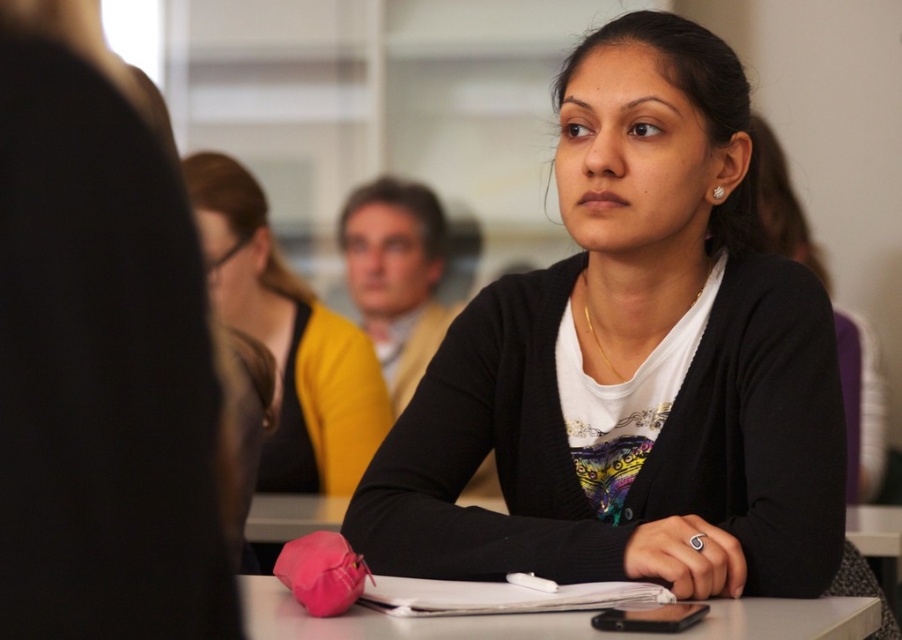
Who is more distant from viewer, (526,328) or (788,621)?

The point (526,328) is more distant.

How much distance is there between black matte cardigan at center and white paper at center?

The distance of black matte cardigan at center from white paper at center is 31.44 centimeters.

You are a GUI agent. You are given a task and a screenshot of the screen. Output one action in this format:
    pyautogui.click(x=<x>, y=<y>)
    Task: Click on the black matte cardigan at center
    The image size is (902, 640).
    Given the screenshot: What is the action you would take?
    pyautogui.click(x=631, y=364)

Between matte yellow sweater at center and white paper at center, which one appears on the left side from the viewer's perspective?

matte yellow sweater at center is more to the left.

Is point (281, 451) positioned after point (344, 632)?

Yes, it is behind point (344, 632).

This screenshot has width=902, height=640. I want to click on matte yellow sweater at center, so click(x=290, y=340).

Between black matte cardigan at center and matte yellow sweater at center, which one appears on the right side from the viewer's perspective?

black matte cardigan at center is more to the right.

Where is `black matte cardigan at center`? This screenshot has width=902, height=640. black matte cardigan at center is located at coordinates (631, 364).

The width and height of the screenshot is (902, 640). What are the coordinates of `black matte cardigan at center` in the screenshot? It's located at (631, 364).